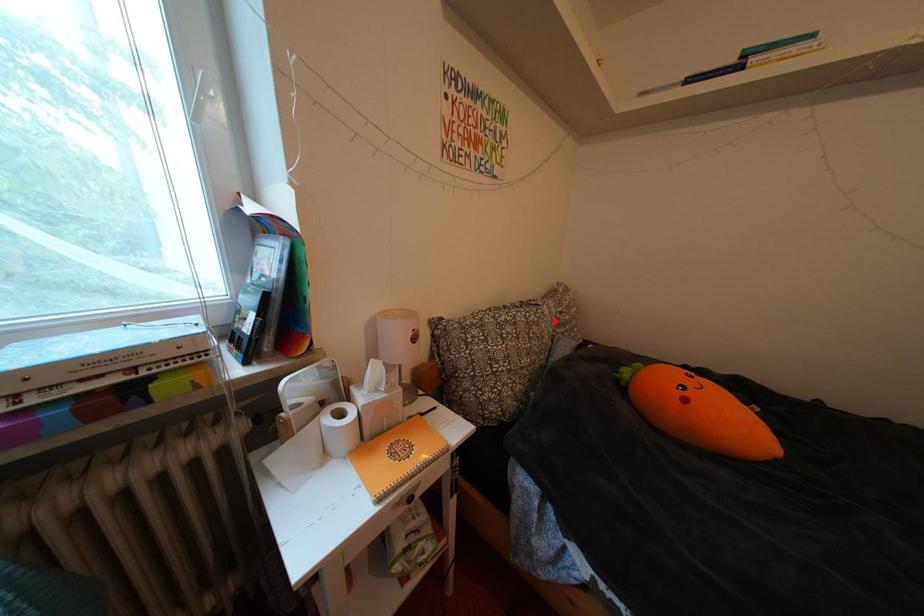
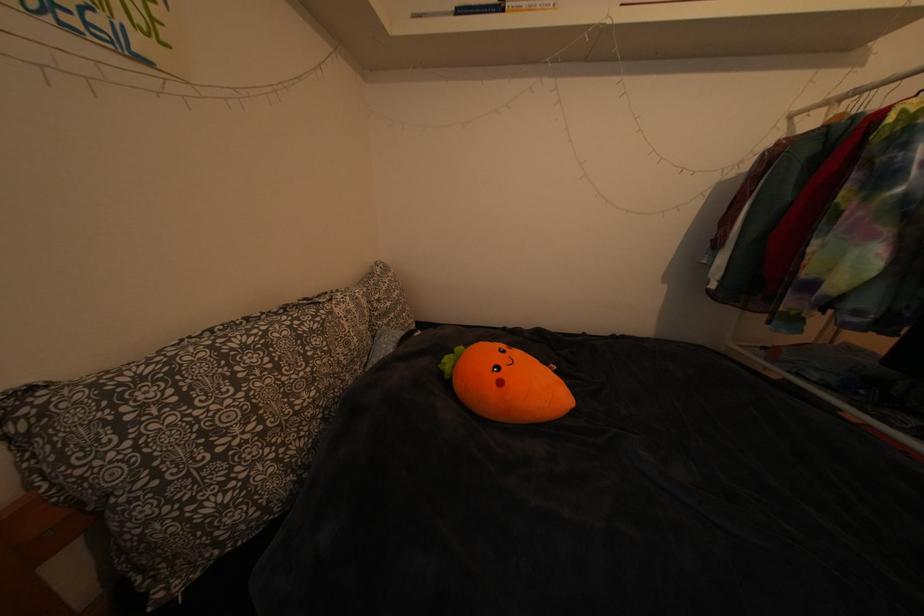
Find the pixel in the second image that matches the highlighted location in the first image.

(359, 317)